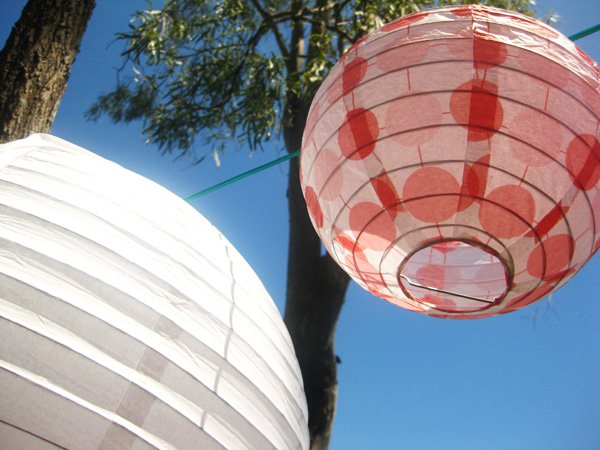
Locate an element on the screen. The width and height of the screenshot is (600, 450). hole at bottom of lantern is located at coordinates (457, 266).